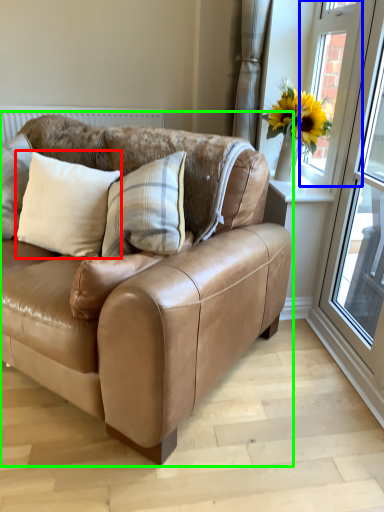
Question: Considering the real-world distances, which object is farthest from pillow (highlighted by a red box)? window (highlighted by a blue box) or studio couch (highlighted by a green box)?

Choices:
 (A) window
 (B) studio couch

Answer: (A)